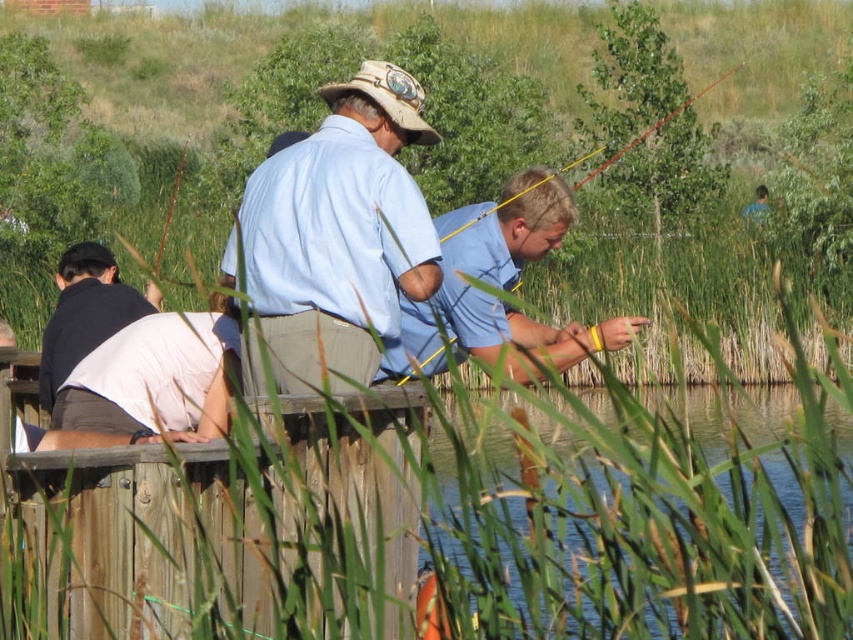
Question: Which of the following is the closest to the observer?

Choices:
 (A) click(x=45, y=401)
 (B) click(x=218, y=513)
 (C) click(x=419, y=365)
 (D) click(x=755, y=605)

Answer: (D)

Question: Which point appears farthest from the camera in this image?

Choices:
 (A) (59, 369)
 (B) (335, 164)
 (C) (604, 492)
 (D) (651, 483)

Answer: (A)

Question: Does light blue cotton shirt at center have a lesser width compared to yellow fishing rod at center?

Choices:
 (A) no
 (B) yes

Answer: (B)

Question: Does light blue cotton shirt at center have a smaller size compared to blue shirt at center?

Choices:
 (A) yes
 (B) no

Answer: (A)

Question: Which point appears closest to the camera in this image?

Choices:
 (A) (726, 557)
 (B) (646, 131)

Answer: (A)

Question: Is clear water at lower right wider than yellow fishing rod at center?

Choices:
 (A) no
 (B) yes

Answer: (A)